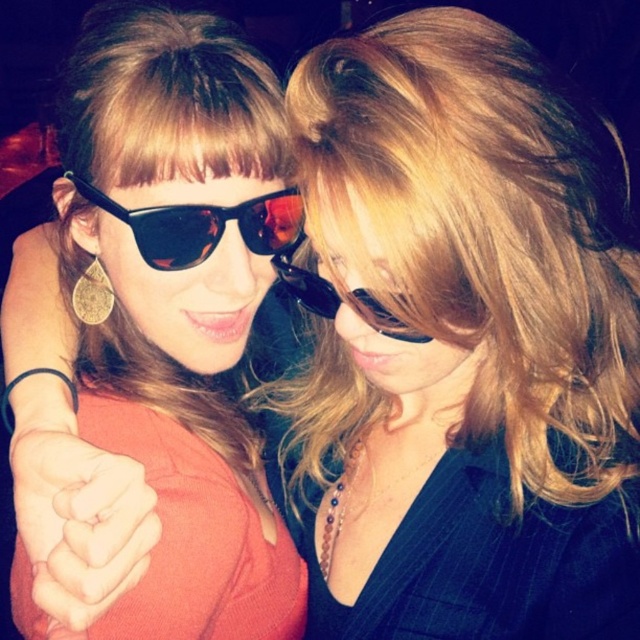
Question: In this image, where is matte black sunglasses at upper left located relative to black plastic sunglasses at center?

Choices:
 (A) right
 (B) left

Answer: (B)

Question: Is matte black sunglasses at upper left further to the viewer compared to black reflective sunglasses at center?

Choices:
 (A) yes
 (B) no

Answer: (B)

Question: Which point is farther to the camera?

Choices:
 (A) black reflective sunglasses at center
 (B) smooth skin fist at center
 (C) matte black sunglasses at upper left
 (D) black plastic sunglasses at center

Answer: (A)

Question: Among these points, which one is farthest from the camera?

Choices:
 (A) (356, 298)
 (B) (164, 51)
 (C) (81, 461)
 (D) (250, 228)

Answer: (D)

Question: Does matte black sunglasses at upper left appear over smooth skin fist at center?

Choices:
 (A) yes
 (B) no

Answer: (A)

Question: Among these objects, which one is nearest to the camera?

Choices:
 (A) black reflective sunglasses at center
 (B) smooth skin fist at center

Answer: (B)